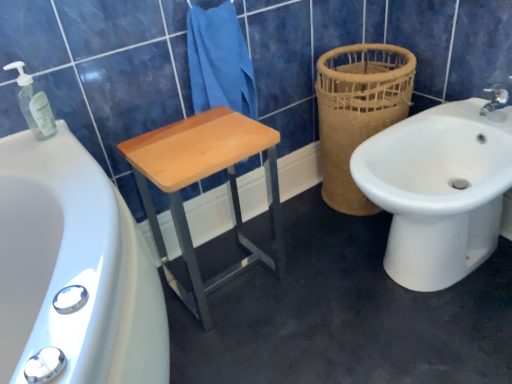
Find the location of a particular element. The width and height of the screenshot is (512, 384). vacant space that's between white ceramic bidet at right and brown woven basket at right is located at coordinates (338, 231).